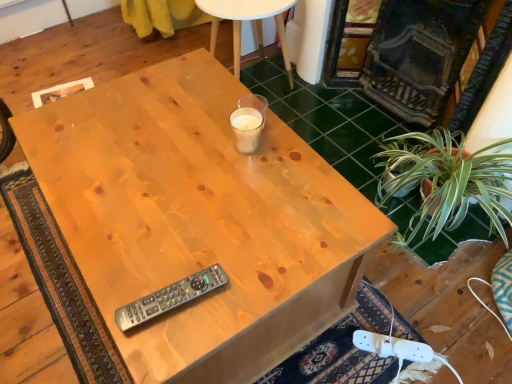
Locate an element on the screen. Image resolution: width=512 pixels, height=384 pixels. vacant space behind gray plastic remote at center is located at coordinates (180, 232).